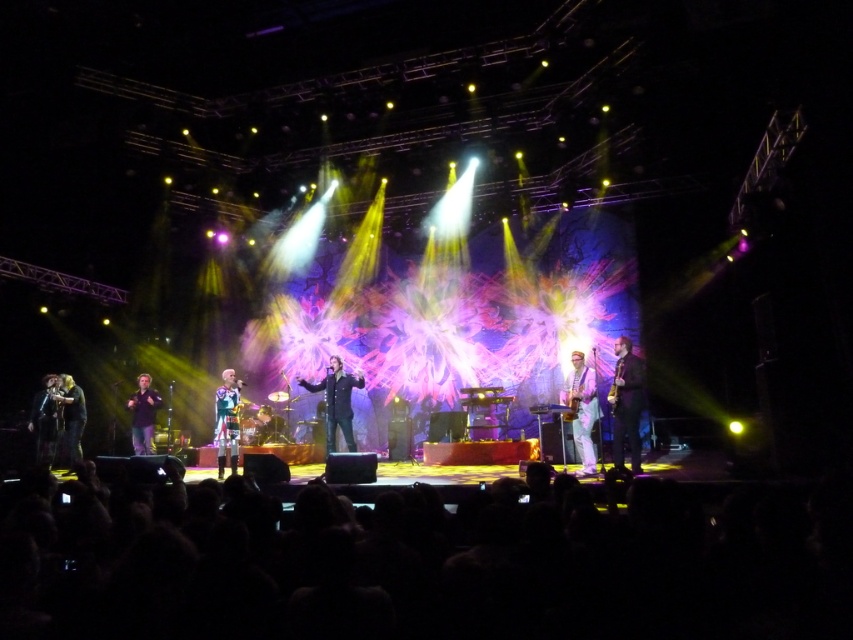
You are a stagehand preparing to move the white glossy saxophone at center and the dark brown leather jacket at left to storage. Given that the storage container can only hold items that take up less space than the jacket, will both items fit?

The white glossy saxophone at center occupies less space than the dark brown leather jacket at left, so it will fit in the storage container. However, the dark brown leather jacket at left may not fit since it takes up more space than the saxophone. The container can only hold items smaller than the jacket, so only the saxophone will fit.

You are a stagehand who needs to adjust the lighting to focus on the shiny silver jacket at center without obstructing the white glossy saxophone at center. Based on their positions, which direction should you move the light source?

The white glossy saxophone at center is in front of the shiny silver jacket at center. To focus on the shiny silver jacket at center without obstructing the saxophone, you should move the light source behind the saxophone so that the light can reach the jacket without being blocked.

You are a photographer in the front row of the concert. You want to capture a photo of both the brown leather jacket at right and the shiny silver jacket at center. Which jacket will appear larger in your photo?

The brown leather jacket at right appears larger in the photo because it is closer to the viewer than the shiny silver jacket at center.